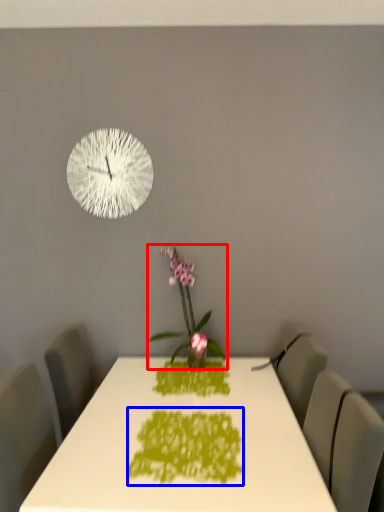
Question: Which object appears closest to the camera in this image, houseplant (highlighted by a red box) or design (highlighted by a blue box)?

Choices:
 (A) houseplant
 (B) design

Answer: (B)